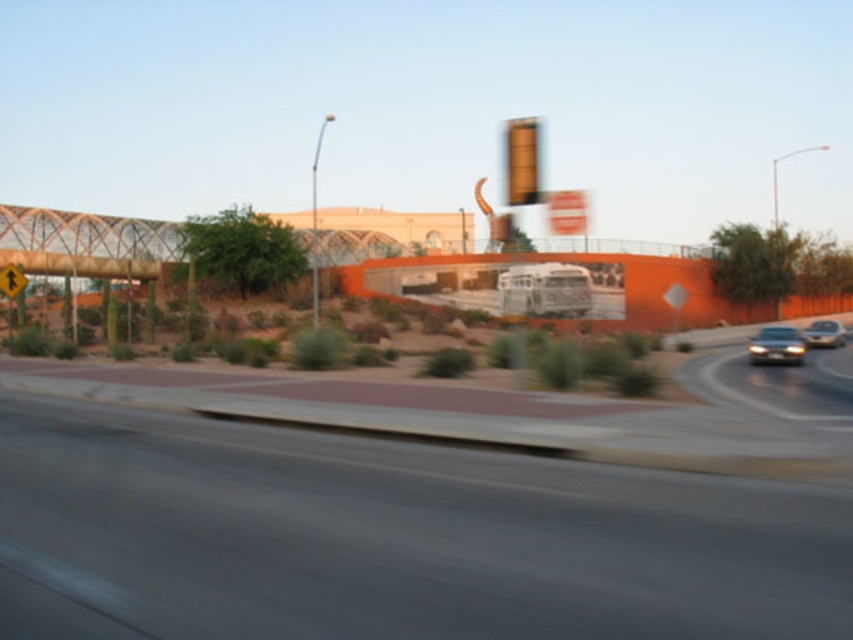
Is gray asphalt highway at center below shiny silver sedan at right?

Indeed, gray asphalt highway at center is positioned under shiny silver sedan at right.

Between gray asphalt highway at center and shiny silver sedan at right, which one has more height?

Standing taller between the two is shiny silver sedan at right.

Is point (262, 554) positioned after point (753, 337)?

No, (262, 554) is closer to viewer.

Identify the location of gray asphalt highway at center. (390, 538).

This screenshot has width=853, height=640. Describe the element at coordinates (86, 243) in the screenshot. I see `metallic glass overpass at center` at that location.

You are a GUI agent. You are given a task and a screenshot of the screen. Output one action in this format:
    pyautogui.click(x=<x>, y=<y>)
    Task: Click on the metallic glass overpass at center
    
    Given the screenshot: What is the action you would take?
    pyautogui.click(x=86, y=243)

Does gray asphalt highway at center have a smaller size compared to matte orange traffic light at upper center?

Correct, gray asphalt highway at center occupies less space than matte orange traffic light at upper center.

Which is more to the left, gray asphalt highway at center or matte orange traffic light at upper center?

Positioned to the left is gray asphalt highway at center.

The image size is (853, 640). What do you see at coordinates (390, 538) in the screenshot? I see `gray asphalt highway at center` at bounding box center [390, 538].

Where is `gray asphalt highway at center`? gray asphalt highway at center is located at coordinates (390, 538).